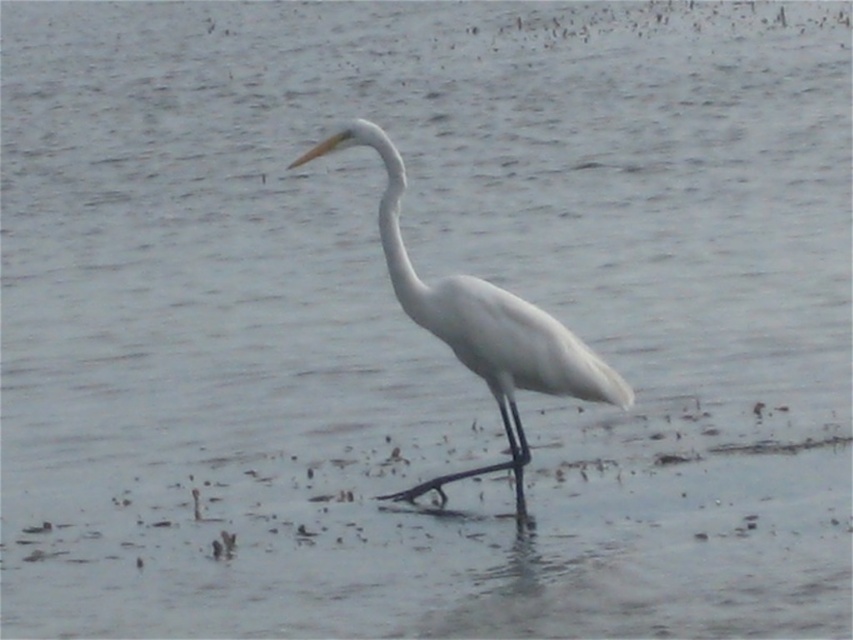
Question: Does white matte bird at center appear under white smooth neck at center?

Choices:
 (A) no
 (B) yes

Answer: (B)

Question: Which object is closer to the camera taking this photo?

Choices:
 (A) white matte bird at center
 (B) white smooth neck at center

Answer: (A)

Question: Is white matte bird at center thinner than white smooth neck at center?

Choices:
 (A) yes
 (B) no

Answer: (B)

Question: Where is white matte bird at center located in relation to white smooth neck at center in the image?

Choices:
 (A) right
 (B) left

Answer: (A)